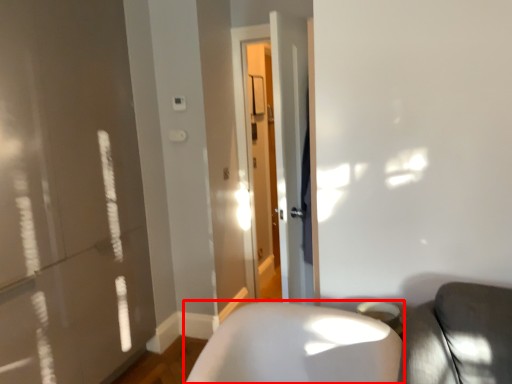
Question: In this image, where is furniture (annotated by the red box) located relative to screen door?

Choices:
 (A) right
 (B) left

Answer: (B)